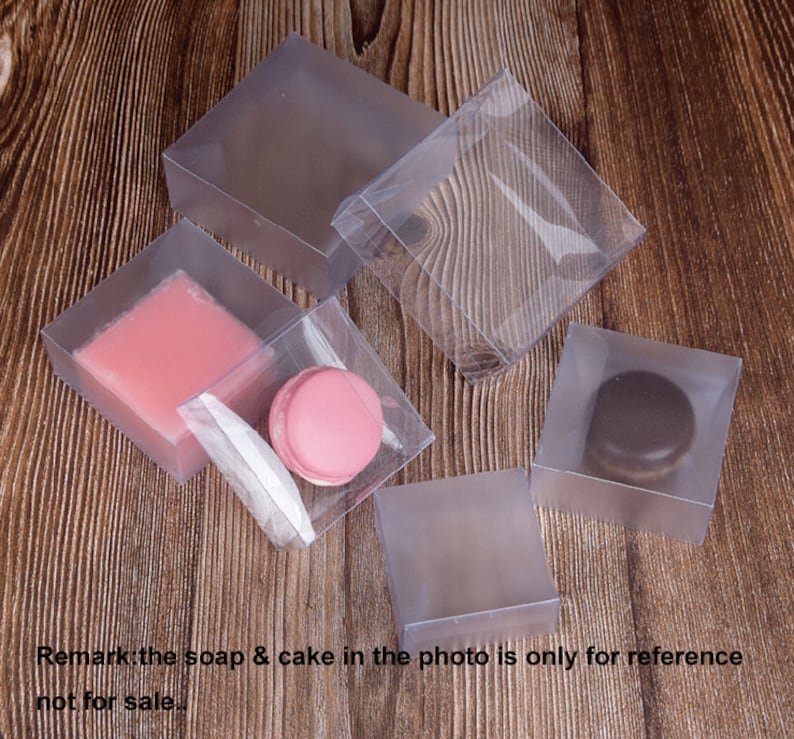
At what (x,y) coordinates should I click in order to perform the action: click on box. Please return your answer as a coordinate pair (x, y). This screenshot has height=739, width=794. Looking at the image, I should click on (492, 364).